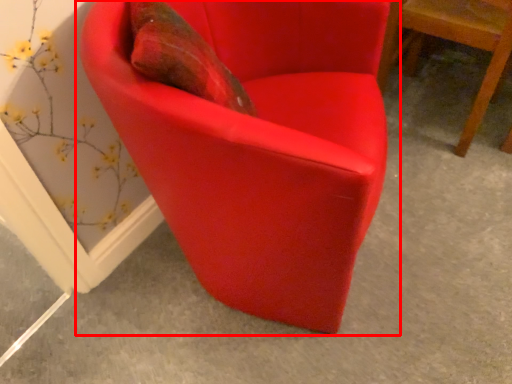
Question: From the image's perspective, where is chair (annotated by the red box) located in relation to chair in the image?

Choices:
 (A) below
 (B) above

Answer: (A)